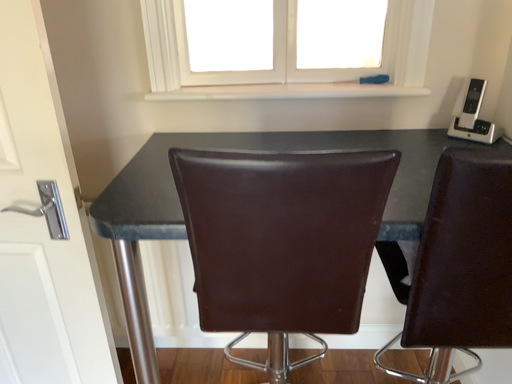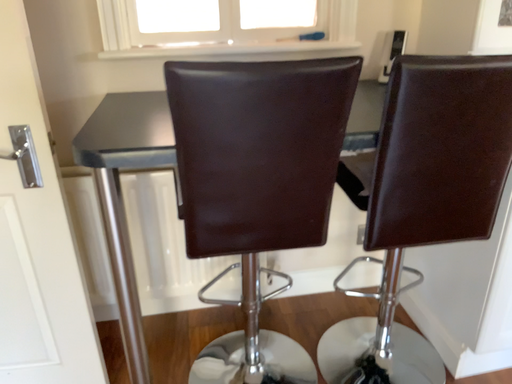
Question: How did the camera likely rotate when shooting the video?

Choices:
 (A) rotated right
 (B) rotated left

Answer: (A)